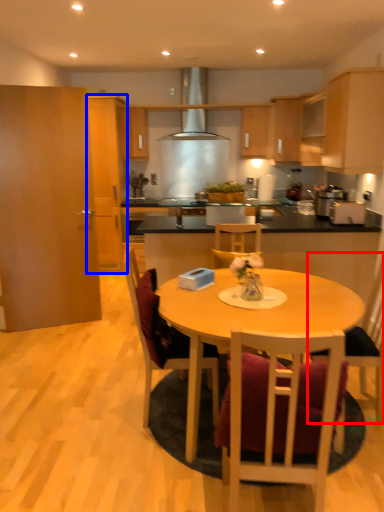
Question: Which object is further to the camera taking this photo, chair (highlighted by a red box) or cabinetry (highlighted by a blue box)?

Choices:
 (A) chair
 (B) cabinetry

Answer: (B)